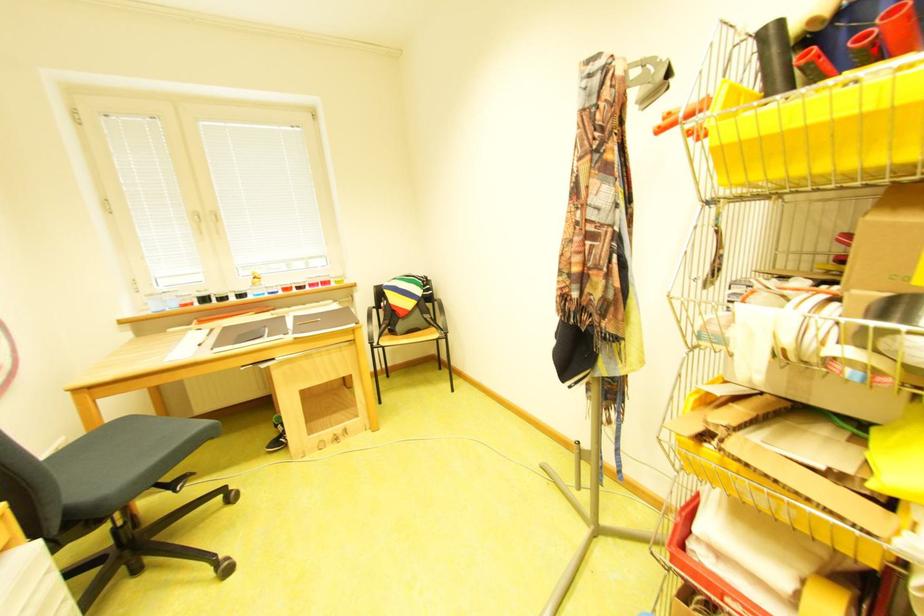
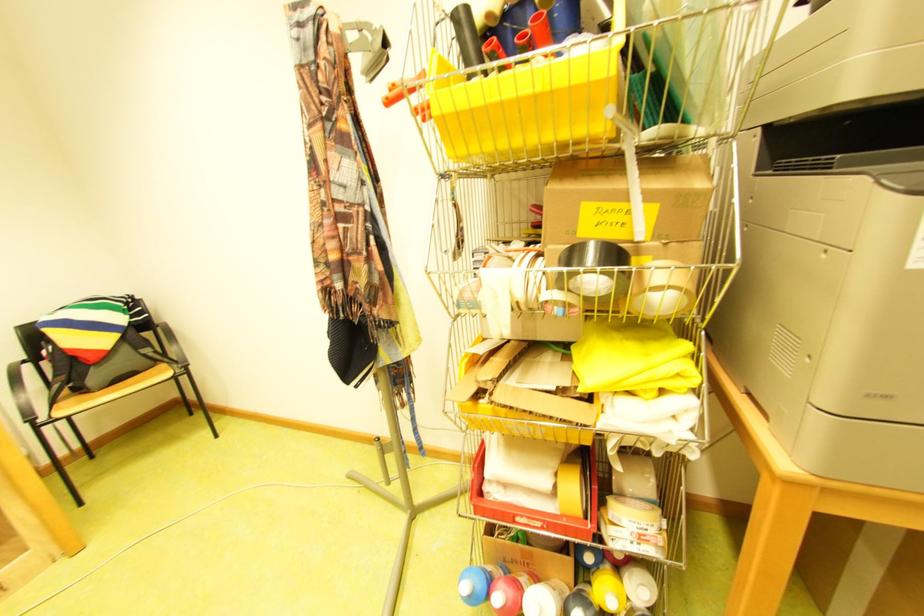
Question: A red point is marked in image1. In image2, is the corresponding 3D point closer to the camera or farther? Reply with the corresponding letter.

Choices:
 (A) The corresponding 3D point is closer.
 (B) The corresponding 3D point is farther.

Answer: (A)